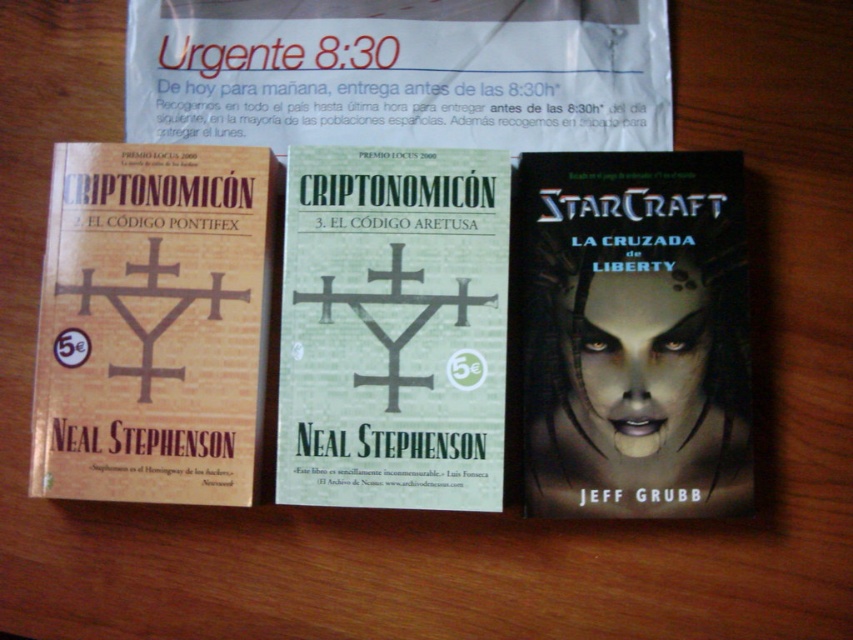
Where is the green matte book at center located in the image?

The green matte book at center is located at point (393, 328).

You are organizing a bookshelf and need to place the matte paper book at left and the matte paper flyer at center. Which item should you place first to ensure they fit side by side without overlapping?

You should place the matte paper book at left first since it has a lesser width compared to the matte paper flyer at center, allowing both to fit side by side without overlapping.

You are arranging items on a shelf and need to place the matte paper book at left and the matte paper flyer at center. If you want to create a layered look with one item in front of the other, which item should you place closer to the front?

To create a layered look with one item in front of the other, place the matte paper book at left closer to the front since it is already closer to the viewer than the matte paper flyer at center.